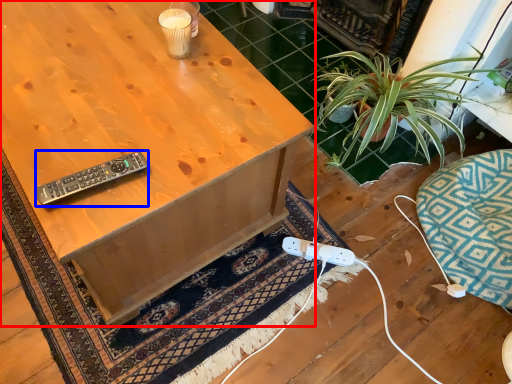
Question: Which point is closer to the camera, desk (highlighted by a red box) or remote control (highlighted by a blue box)?

Choices:
 (A) desk
 (B) remote control

Answer: (A)